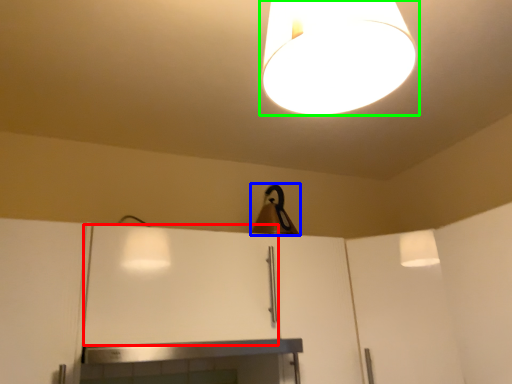
Question: Which object is the closest to the cabinetry (highlighted by a red box)? Choose among these: lamp (highlighted by a blue box) or lamp (highlighted by a green box).

Choices:
 (A) lamp
 (B) lamp

Answer: (A)